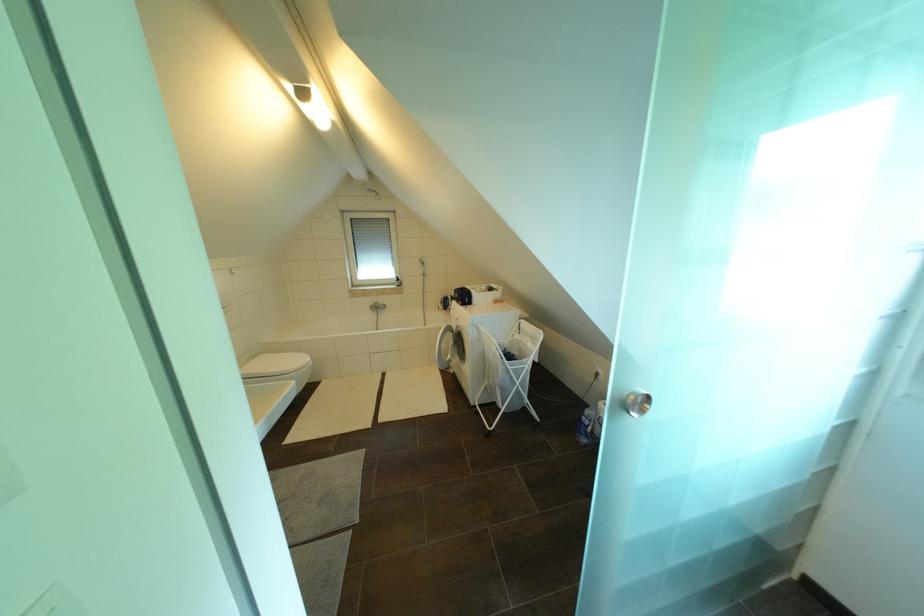
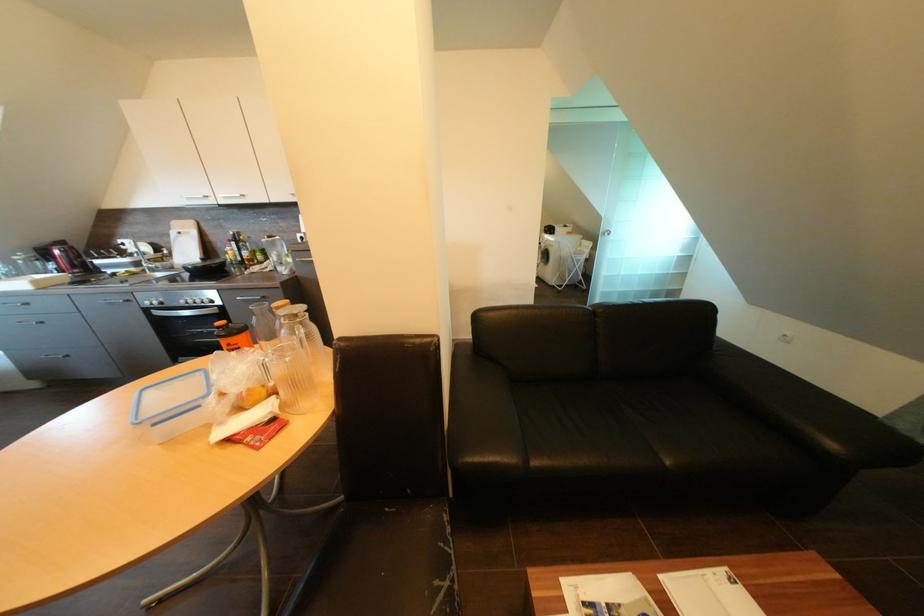
Question: In a continuous first-person perspective shot, in which direction is the camera moving?

Choices:
 (A) Left
 (B) Right
 (C) Forward
 (D) Backward

Answer: (D)